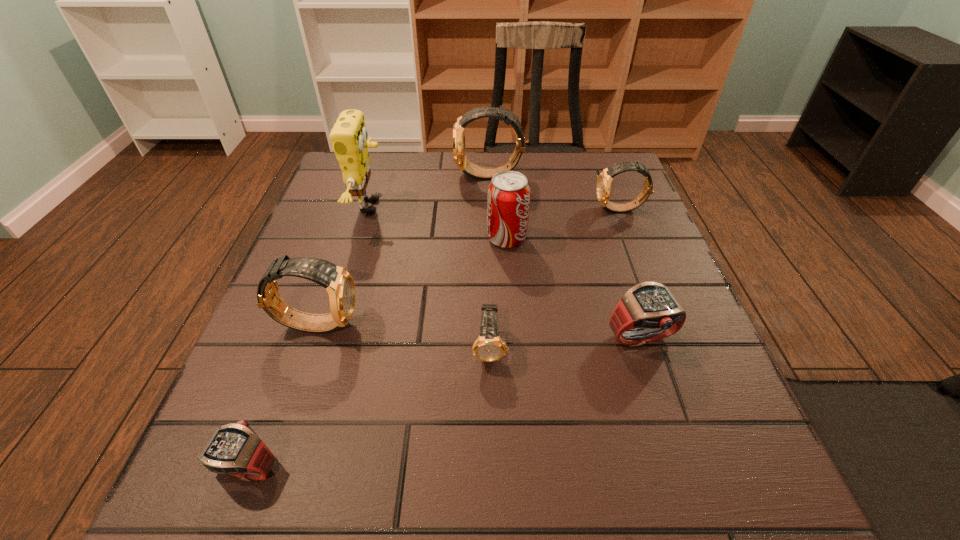
This screenshot has height=540, width=960. I want to click on the tallest object, so click(x=349, y=137).

Locate an element on the screen. the farthest gold watch is located at coordinates (469, 168).

The width and height of the screenshot is (960, 540). What are the coordinates of `the farthest watch` in the screenshot? It's located at (469, 168).

I want to click on the second biggest gold watch, so click(x=339, y=284).

Where is `the fifth shortest watch`? the fifth shortest watch is located at coordinates (339, 284).

Image resolution: width=960 pixels, height=540 pixels. I want to click on soda, so click(508, 202).

Locate an element on the screen. the fourth shortest object is located at coordinates (604, 181).

Where is `the fifth nearest watch`? The height and width of the screenshot is (540, 960). the fifth nearest watch is located at coordinates (604, 181).

Identify the location of the bigger red watch. (648, 311).

This screenshot has height=540, width=960. In order to click on the right red watch in this screenshot , I will do pos(648,311).